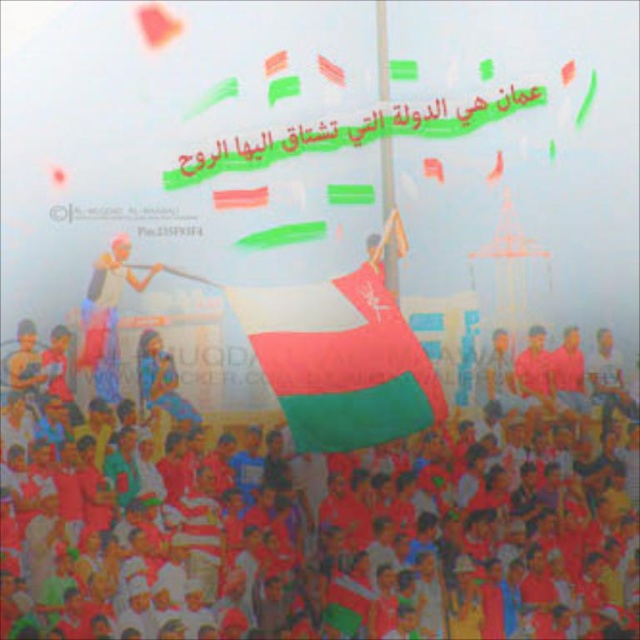
Question: Which point is farther to the camera?

Choices:
 (A) red fabric crowd at center
 (B) white fabric flag at center

Answer: (B)

Question: Which object appears closest to the camera in this image?

Choices:
 (A) beige fabric cloth at left
 (B) red fabric crowd at center

Answer: (B)

Question: Is white fabric flag at center smaller than beige fabric cloth at left?

Choices:
 (A) no
 (B) yes

Answer: (A)

Question: Does red fabric crowd at center appear under beige fabric cloth at left?

Choices:
 (A) no
 (B) yes

Answer: (B)

Question: Does white fabric flag at center appear on the left side of beige fabric cloth at left?

Choices:
 (A) no
 (B) yes

Answer: (A)

Question: Among these points, which one is nearest to the camera?

Choices:
 (A) (26, 572)
 (B) (92, 308)

Answer: (A)